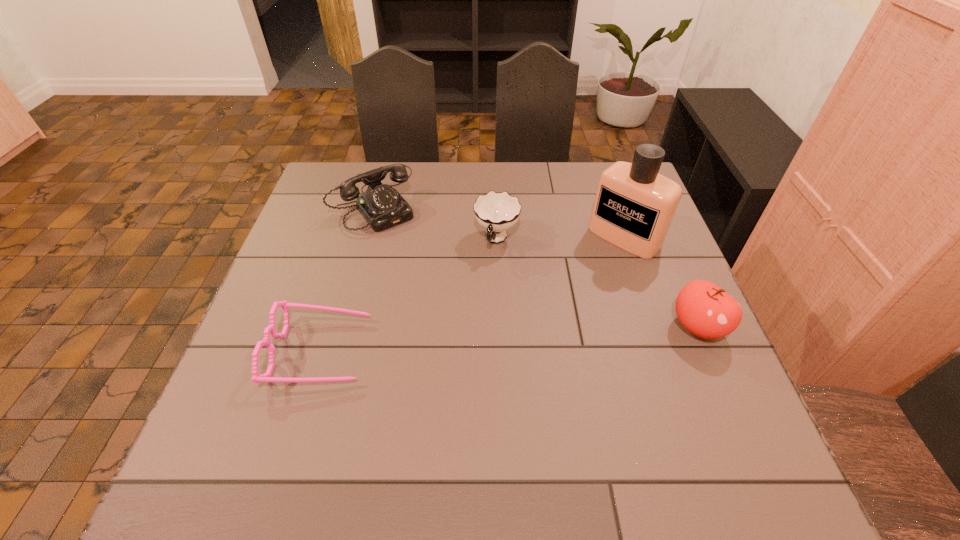
Find the location of a particular element. The image size is (960, 540). apple located at the right edge is located at coordinates (704, 309).

Find the location of a particular element. The image size is (960, 540). perfume present at the right edge is located at coordinates (634, 206).

I want to click on object that is positioned at the far left corner, so [x=382, y=206].

Where is `object present at the near left corner`? object present at the near left corner is located at coordinates (266, 377).

Where is `vacant area at the far edge of the desktop`? This screenshot has width=960, height=540. vacant area at the far edge of the desktop is located at coordinates (479, 170).

The image size is (960, 540). I want to click on vacant space at the left edge, so click(x=268, y=361).

Image resolution: width=960 pixels, height=540 pixels. In the image, there is a desktop. Identify the location of vacant space at the right edge. (706, 347).

Where is `blank space at the far left corner of the desktop`? This screenshot has height=540, width=960. blank space at the far left corner of the desktop is located at coordinates (341, 162).

This screenshot has width=960, height=540. In the image, there is a desktop. What are the coordinates of `vacant space at the far right corner` in the screenshot? It's located at (591, 183).

At what (x,y) coordinates should I click in order to perform the action: click on vacant point located between the tallest object and the spectacles. Please return your answer as a coordinate pair (x, y). This screenshot has height=540, width=960. Looking at the image, I should click on (473, 294).